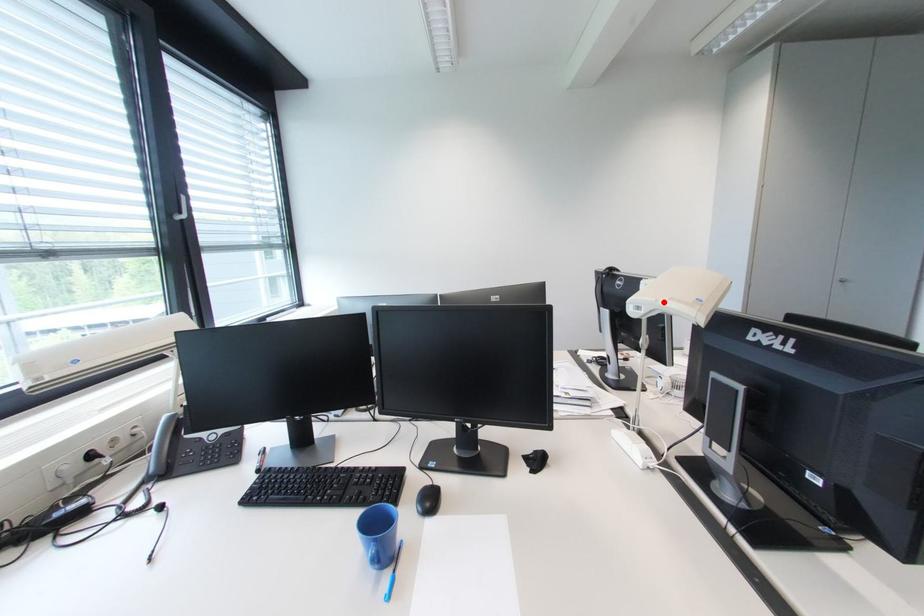
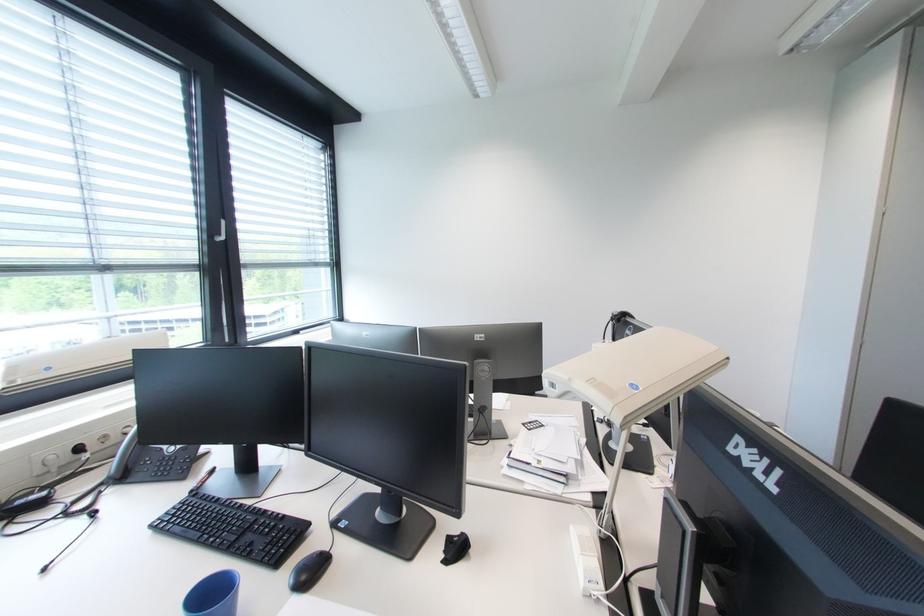
The point at the highlighted location is marked in the first image. Where is the corresponding point in the second image?

(577, 381)